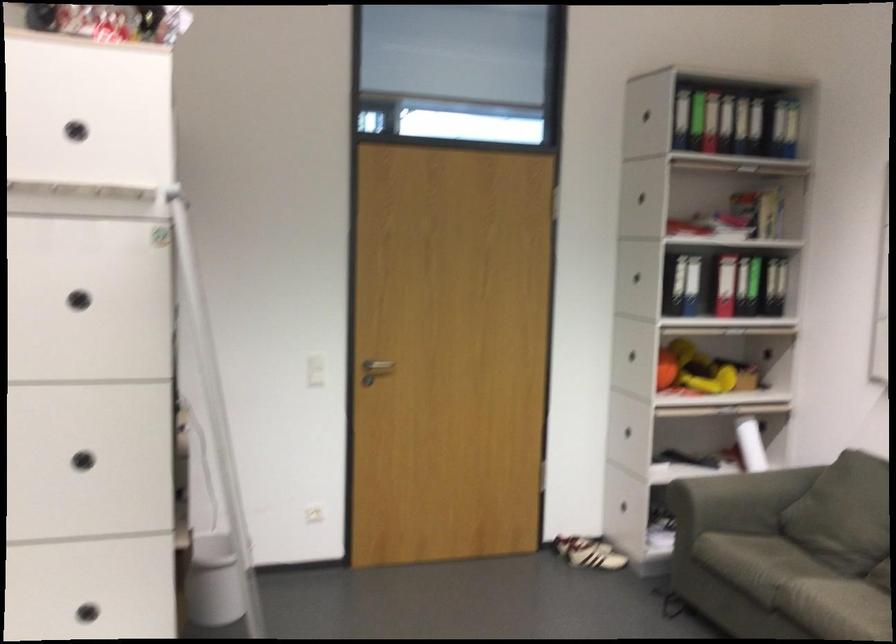
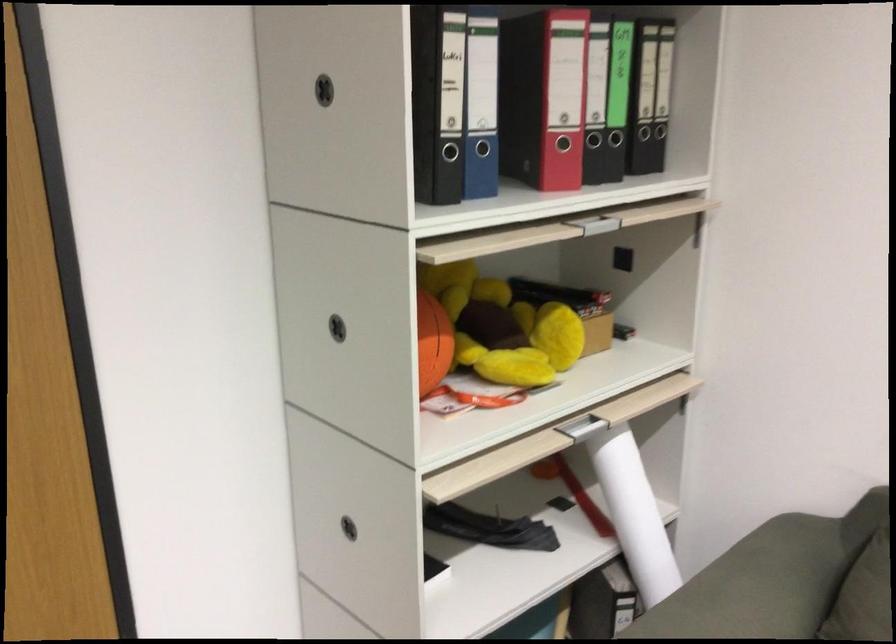
The point at [617,429] is marked in the first image. Where is the corresponding point in the second image?

(348, 527)